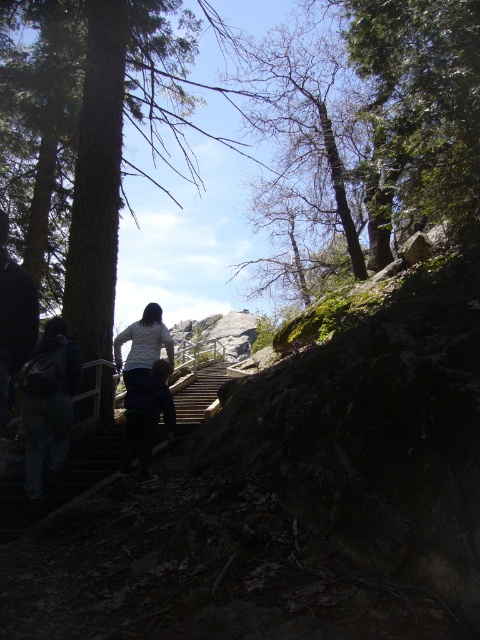
Question: Which point is closer to the camera?

Choices:
 (A) (6, 348)
 (B) (14, 4)
 (C) (216, 378)
 (D) (135, 333)

Answer: (A)

Question: Does denim jacket at lower left appear over dark blue jeans at left?

Choices:
 (A) no
 (B) yes

Answer: (A)

Question: Which point appears closest to the camera in this image?

Choices:
 (A) (32, 337)
 (B) (64, 465)
 (C) (167, 99)

Answer: (A)

Question: Does dark blue jeans at left have a larger size compared to dark blue jacket at center?

Choices:
 (A) yes
 (B) no

Answer: (B)

Question: Estimate the real-world distances between objects in this image. Which object is closer to the dark blue jacket at center?

Choices:
 (A) green textured tree at upper left
 (B) dark blue jeans at left
 (C) denim jacket at lower left
 (D) wooden stairs at lower left

Answer: (C)

Question: Can you confirm if green textured tree at upper left is bigger than dark blue jeans at left?

Choices:
 (A) no
 (B) yes

Answer: (B)